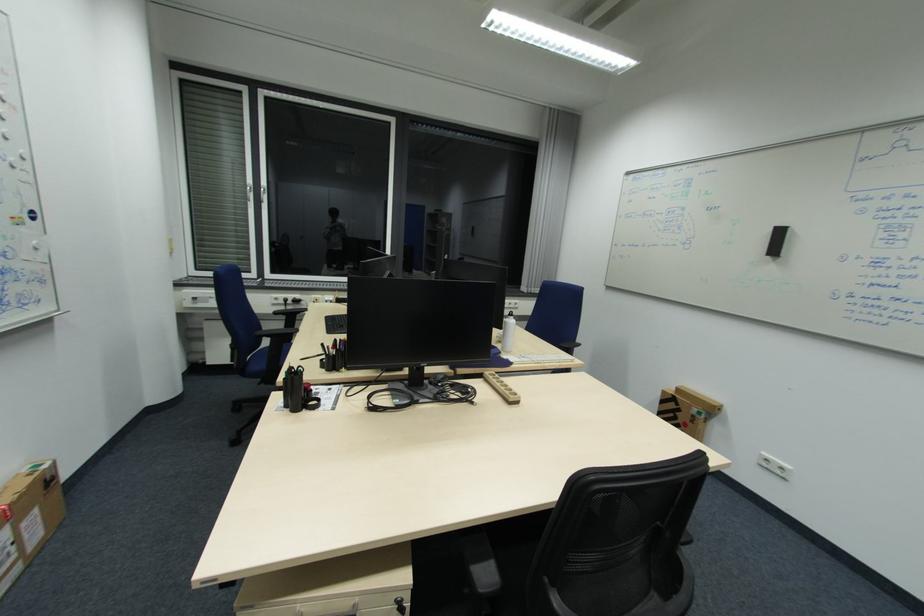
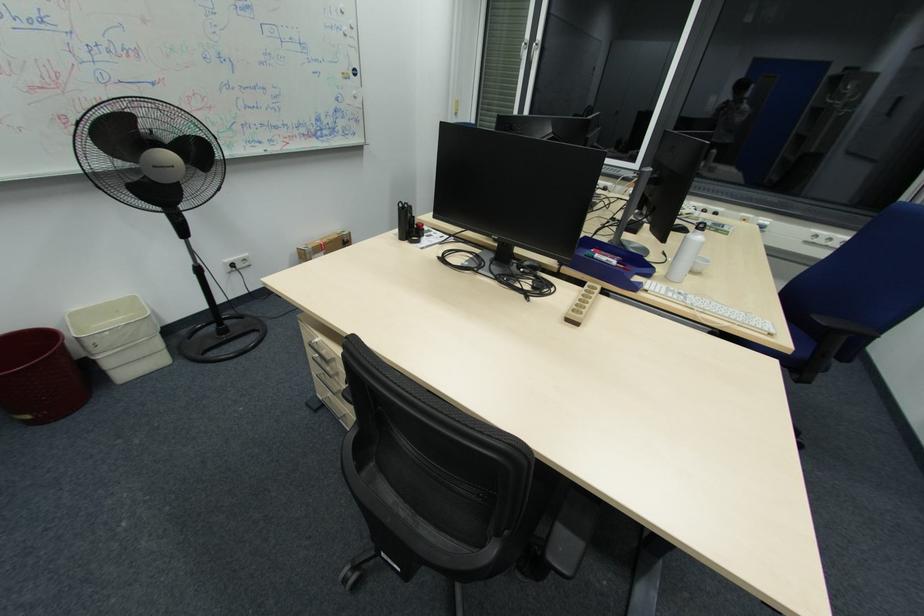
First-person continuous shooting, in which direction is the camera rotating?

The camera rotated toward left-down.